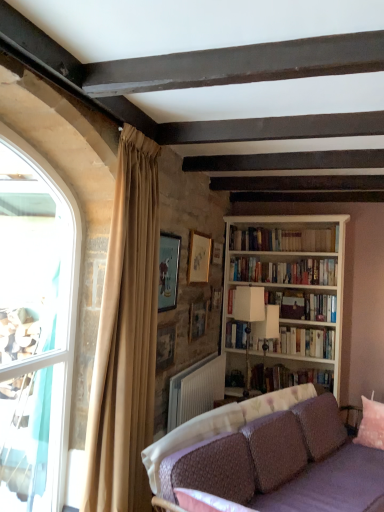
Question: Can you confirm if hardcover book at center, the first book when ordered from bottom to top, is smaller than wooden bookshelf at upper right, the 4th book ordered from the bottom?

Choices:
 (A) yes
 (B) no

Answer: (A)

Question: From the image's perspective, would you say hardcover book at center, which is the 4th book from top to bottom, is shown under wooden bookshelf at upper right, which ranks as the first book in top-to-bottom order?

Choices:
 (A) yes
 (B) no

Answer: (A)

Question: Can you confirm if hardcover book at center, which is the 4th book from top to bottom, is positioned to the right of wooden bookshelf at upper right, the 4th book ordered from the bottom?

Choices:
 (A) no
 (B) yes

Answer: (B)

Question: Is there a large distance between hardcover book at center, the first book when ordered from bottom to top, and wooden bookshelf at upper right, which ranks as the first book in top-to-bottom order?

Choices:
 (A) no
 (B) yes

Answer: (B)

Question: From a real-world perspective, is hardcover book at center, which is the 4th book from top to bottom, on wooden bookshelf at upper right, which ranks as the first book in top-to-bottom order?

Choices:
 (A) yes
 (B) no

Answer: (B)

Question: Does hardcover book at center, which is the 4th book from top to bottom, have a lesser width compared to wooden bookshelf at upper right, the 4th book ordered from the bottom?

Choices:
 (A) no
 (B) yes

Answer: (A)

Question: Considering the relative sizes of white wooden bookcase at right and white fabric lampshade at center, marked as the second lamp in a front-to-back arrangement, in the image provided, is white wooden bookcase at right shorter than white fabric lampshade at center, marked as the second lamp in a front-to-back arrangement,?

Choices:
 (A) yes
 (B) no

Answer: (B)

Question: Is white wooden bookcase at right located outside white fabric lampshade at center, which is the 1th lamp in back-to-front order?

Choices:
 (A) no
 (B) yes

Answer: (B)

Question: Is white wooden bookcase at right placed right next to white fabric lampshade at center, marked as the second lamp in a front-to-back arrangement?

Choices:
 (A) yes
 (B) no

Answer: (B)

Question: Is white wooden bookcase at right thinner than white fabric lampshade at center, marked as the second lamp in a front-to-back arrangement?

Choices:
 (A) no
 (B) yes

Answer: (A)

Question: From a real-world perspective, is white wooden bookcase at right located higher than white fabric lampshade at center, marked as the second lamp in a front-to-back arrangement?

Choices:
 (A) no
 (B) yes

Answer: (B)

Question: Is the depth of white wooden bookcase at right greater than that of white fabric lampshade at center, marked as the second lamp in a front-to-back arrangement?

Choices:
 (A) yes
 (B) no

Answer: (A)

Question: Is matte wooden picture frame at upper center, which appears as the first picture frame when viewed from the front, outside of white matte lamp at center, which is counted as the first lamp, starting from the front?

Choices:
 (A) yes
 (B) no

Answer: (A)